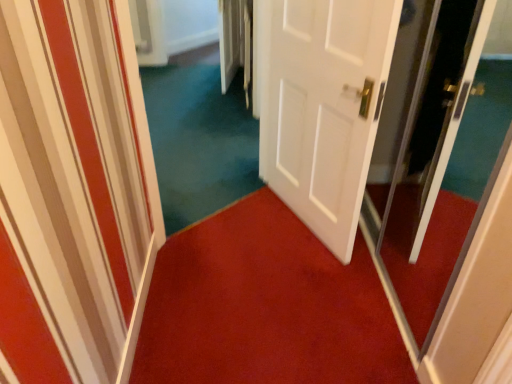
Question: From the image's perspective, is white matte door at center on top of teal carpet at center?

Choices:
 (A) no
 (B) yes

Answer: (A)

Question: Can we say white matte door at center lies outside teal carpet at center?

Choices:
 (A) no
 (B) yes

Answer: (B)

Question: Is white matte door at center thinner than teal carpet at center?

Choices:
 (A) yes
 (B) no

Answer: (A)

Question: Does white matte door at center have a larger size compared to teal carpet at center?

Choices:
 (A) yes
 (B) no

Answer: (B)

Question: Is white matte door at center to the right of teal carpet at center from the viewer's perspective?

Choices:
 (A) no
 (B) yes

Answer: (B)

Question: Considering the relative positions of teal carpet at center and transparent glass screen door at right in the image provided, is teal carpet at center to the left or to the right of transparent glass screen door at right?

Choices:
 (A) left
 (B) right

Answer: (A)

Question: Is teal carpet at center situated inside transparent glass screen door at right or outside?

Choices:
 (A) outside
 (B) inside

Answer: (A)

Question: In terms of size, does teal carpet at center appear bigger or smaller than transparent glass screen door at right?

Choices:
 (A) big
 (B) small

Answer: (A)

Question: Does point (204, 66) appear closer or farther from the camera than point (429, 273)?

Choices:
 (A) closer
 (B) farther

Answer: (B)

Question: Relative to transparent glass screen door at right, is red carpet at center in front or behind?

Choices:
 (A) front
 (B) behind

Answer: (B)

Question: From the image's perspective, relative to transparent glass screen door at right, is red carpet at center above or below?

Choices:
 (A) below
 (B) above

Answer: (A)

Question: Based on their sizes in the image, would you say red carpet at center is bigger or smaller than transparent glass screen door at right?

Choices:
 (A) big
 (B) small

Answer: (A)

Question: In terms of width, does red carpet at center look wider or thinner when compared to transparent glass screen door at right?

Choices:
 (A) wide
 (B) thin

Answer: (A)

Question: Relative to transparent glass screen door at right, is white matte door at center in front or behind?

Choices:
 (A) behind
 (B) front

Answer: (A)

Question: Based on their sizes in the image, would you say white matte door at center is bigger or smaller than transparent glass screen door at right?

Choices:
 (A) small
 (B) big

Answer: (B)